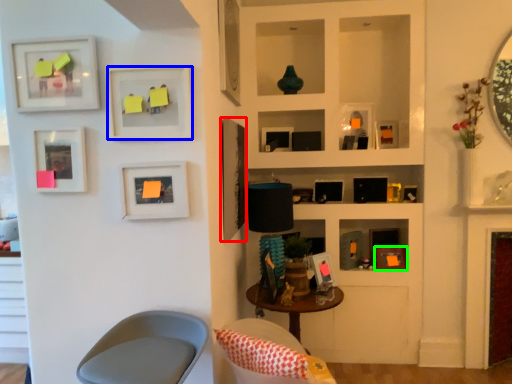
Question: Considering the real-world distances, which object is farthest from picture frame (highlighted by a red box)? picture frame (highlighted by a blue box) or picture frame (highlighted by a green box)?

Choices:
 (A) picture frame
 (B) picture frame

Answer: (B)